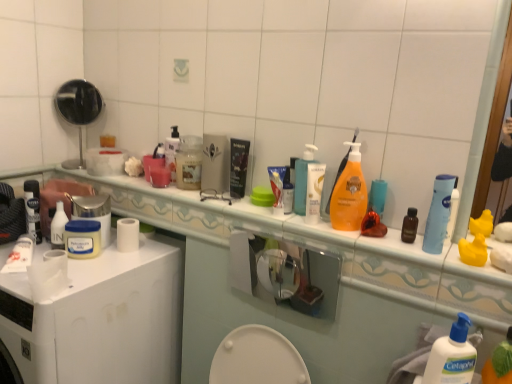
Question: Are blue plastic tube at upper right, which ranks as the 3th mouthwash in left-to-right order, and white matte jar at center-left, which ranks as the third toiletry in right-to-left order, beside each other?

Choices:
 (A) yes
 (B) no

Answer: (B)

Question: Considering the relative sizes of blue plastic tube at upper right, which ranks as the 3th mouthwash in left-to-right order, and white matte jar at center-left, the 3th toiletry from the front, in the image provided, is blue plastic tube at upper right, which ranks as the 3th mouthwash in left-to-right order, bigger than white matte jar at center-left, the 3th toiletry from the front,?

Choices:
 (A) yes
 (B) no

Answer: (B)

Question: Is white matte jar at center-left, the 3th toiletry from the front, surrounded by blue plastic tube at upper right, marked as the 1th mouthwash in a front-to-back arrangement?

Choices:
 (A) no
 (B) yes

Answer: (A)

Question: From a real-world perspective, is blue plastic tube at upper right, which ranks as the 3th mouthwash in left-to-right order, under white matte jar at center-left, the 3th toiletry from the front?

Choices:
 (A) no
 (B) yes

Answer: (A)

Question: Is blue plastic tube at upper right, which ranks as the 3th mouthwash in left-to-right order, far away from white matte jar at center-left, which ranks as the third toiletry in right-to-left order?

Choices:
 (A) yes
 (B) no

Answer: (A)

Question: Would you say blue plastic tube at upper right, marked as the 1th mouthwash in a front-to-back arrangement, is outside white matte jar at center-left, the 3th toiletry from the front?

Choices:
 (A) yes
 (B) no

Answer: (A)

Question: From the image's perspective, is blue plastic tube at upper right, the first mouthwash viewed from the right, located beneath white plastic washing machine at lower left?

Choices:
 (A) yes
 (B) no

Answer: (B)

Question: Is blue plastic tube at upper right, the first mouthwash viewed from the right, positioned before white plastic washing machine at lower left?

Choices:
 (A) yes
 (B) no

Answer: (B)

Question: From the image's perspective, is blue plastic tube at upper right, positioned as the third mouthwash in back-to-front order, above white plastic washing machine at lower left?

Choices:
 (A) no
 (B) yes

Answer: (B)

Question: Can we say blue plastic tube at upper right, marked as the 1th mouthwash in a front-to-back arrangement, lies outside white plastic washing machine at lower left?

Choices:
 (A) yes
 (B) no

Answer: (A)

Question: Is blue plastic tube at upper right, which ranks as the 3th mouthwash in left-to-right order, bigger than white plastic washing machine at lower left?

Choices:
 (A) no
 (B) yes

Answer: (A)

Question: From a real-world perspective, is white plastic jar at upper left, the 1th mouthwash viewed from the left, physically below translucent plastic tube at center, the second toiletry from the right?

Choices:
 (A) no
 (B) yes

Answer: (B)